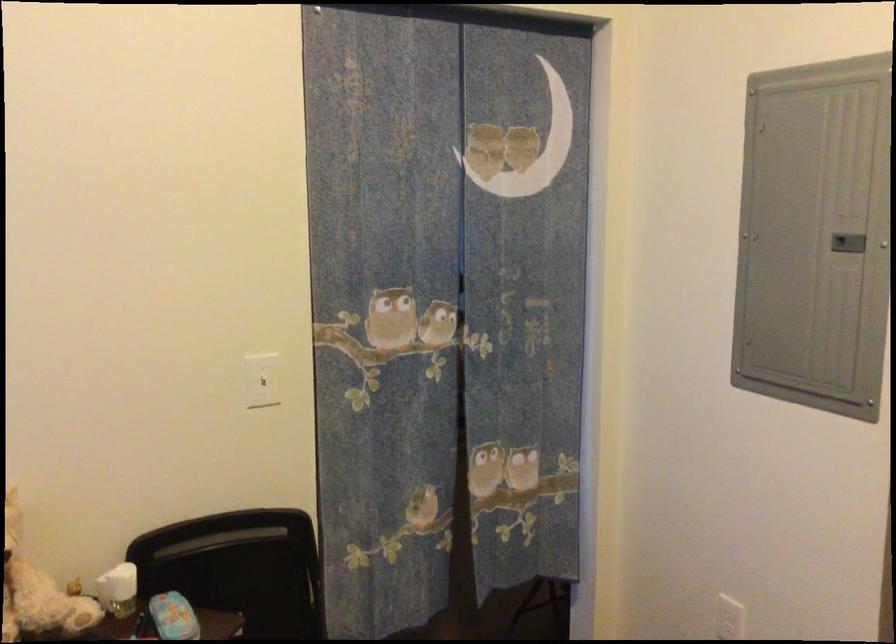
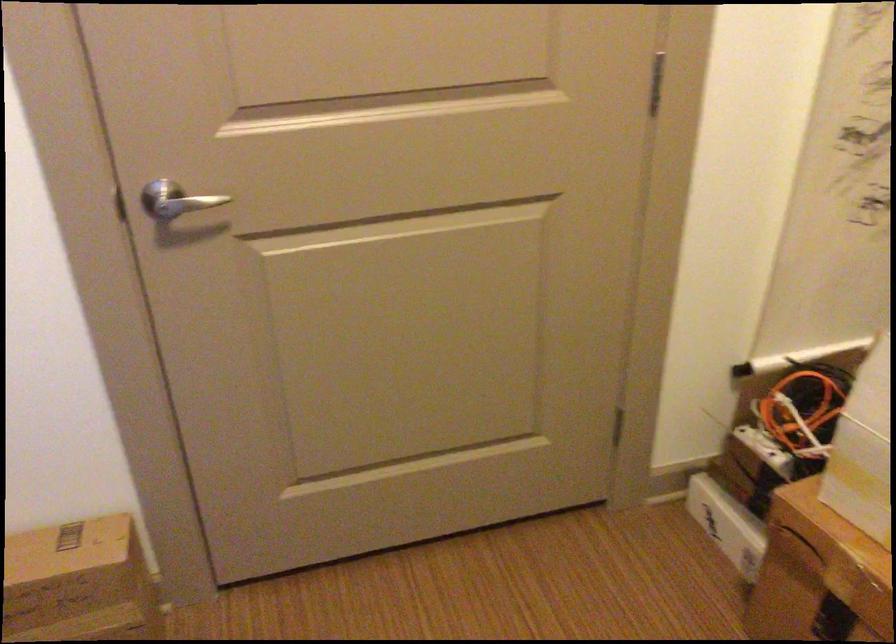
How did the camera likely rotate?

The camera rotated toward right-down.